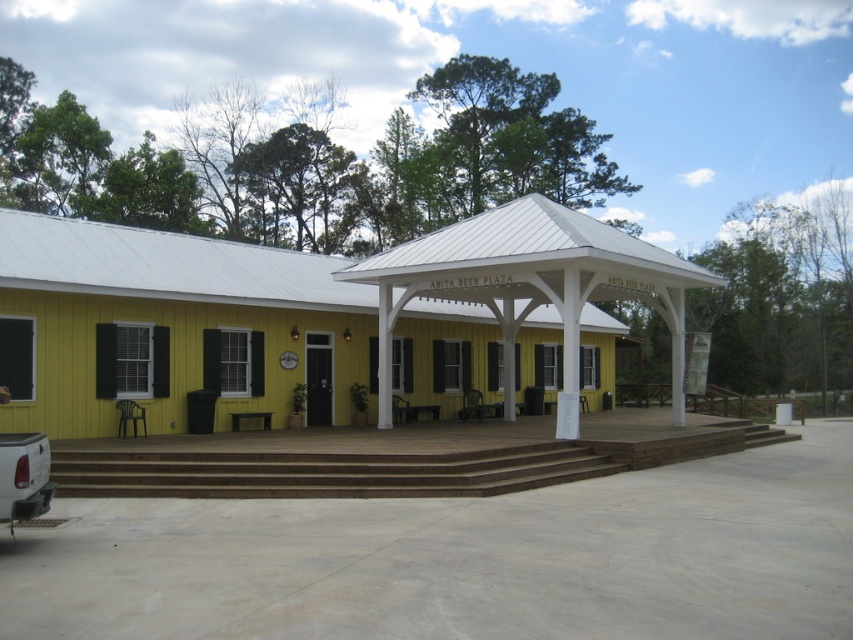
Question: Is brown wooden porch at center positioned behind brown wooden stairs at center?

Choices:
 (A) yes
 (B) no

Answer: (A)

Question: Which of the following is the farthest from the observer?

Choices:
 (A) pos(451,472)
 (B) pos(605,452)

Answer: (B)

Question: Can you confirm if brown wooden porch at center is positioned above brown wooden stairs at center?

Choices:
 (A) yes
 (B) no

Answer: (B)

Question: Which point is farther to the camera?

Choices:
 (A) (409, 456)
 (B) (520, 426)

Answer: (B)

Question: Is brown wooden porch at center behind brown wooden stairs at center?

Choices:
 (A) yes
 (B) no

Answer: (A)

Question: Which object appears farthest from the camera in this image?

Choices:
 (A) brown wooden porch at center
 (B) brown wooden stairs at center

Answer: (A)